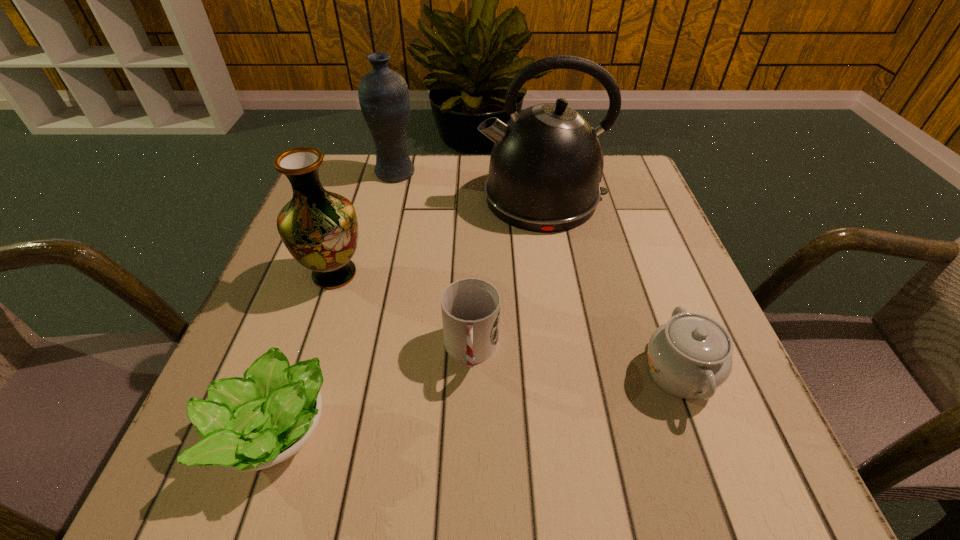
Find the location of a particular element. The image size is (960, 540). kettle is located at coordinates (546, 163).

This screenshot has height=540, width=960. I want to click on the farther vase, so click(384, 98).

At what (x,y) coordinates should I click in order to perform the action: click on the third farthest object. Please return your answer as a coordinate pair (x, y). The image size is (960, 540). Looking at the image, I should click on (319, 228).

The height and width of the screenshot is (540, 960). Identify the location of chinaware. (690, 356).

Find the location of a particular element. This screenshot has width=960, height=540. cup is located at coordinates (470, 307).

At what (x,y) coordinates should I click in order to perform the action: click on the shortest object. Please return your answer as a coordinate pair (x, y). Looking at the image, I should click on (248, 424).

Locate an element on the screen. The width and height of the screenshot is (960, 540). blank space located 0.150m on the spout of the kettle is located at coordinates (417, 198).

Image resolution: width=960 pixels, height=540 pixels. I want to click on vacant space positioned on the spout of the kettle, so click(330, 198).

You are a GUI agent. You are given a task and a screenshot of the screen. Output one action in this format:
    pyautogui.click(x=<x>, y=<y>)
    Task: Click on the free space located on the spout of the kettle
    Image resolution: width=960 pixels, height=540 pixels.
    Given the screenshot: What is the action you would take?
    359,198

You are a GUI agent. You are given a task and a screenshot of the screen. Output one action in this format:
    pyautogui.click(x=<x>, y=<y>)
    Task: Click on the free location located 0.100m on the left of the farther vase
    This screenshot has height=540, width=960.
    Given the screenshot: What is the action you would take?
    pyautogui.click(x=335, y=172)